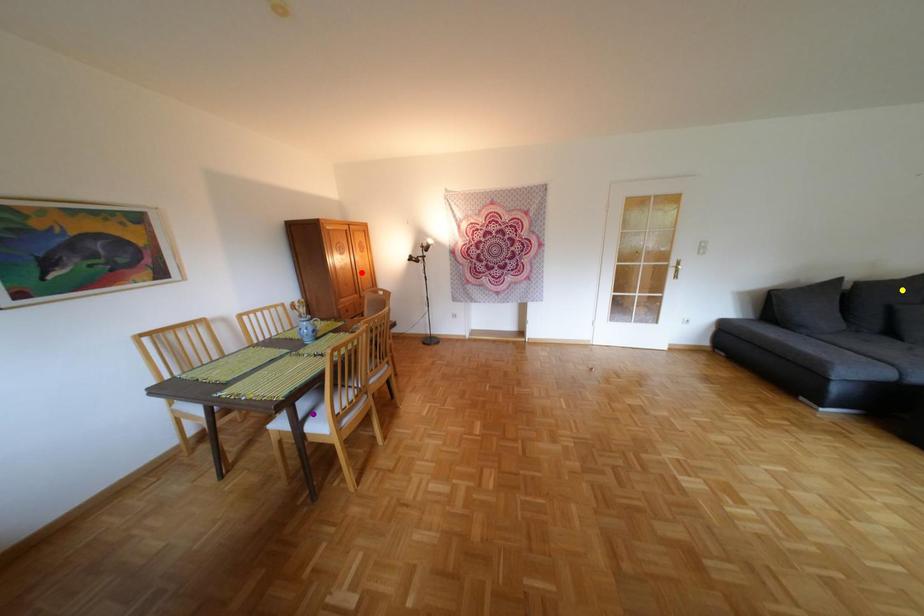
Order these from nearest to farthest:
red point, purple point, yellow point

red point
yellow point
purple point